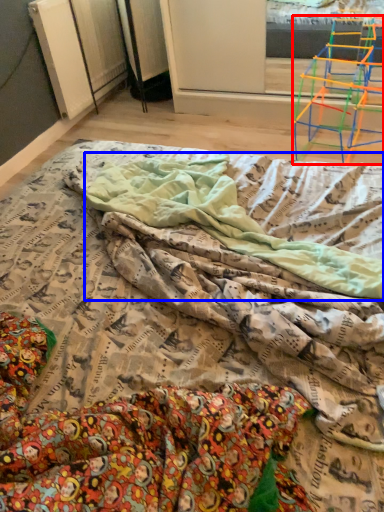
Question: Which of the following is the closest to the observer, furniture (highlighted by a red box) or blanket (highlighted by a blue box)?

Choices:
 (A) furniture
 (B) blanket

Answer: (B)